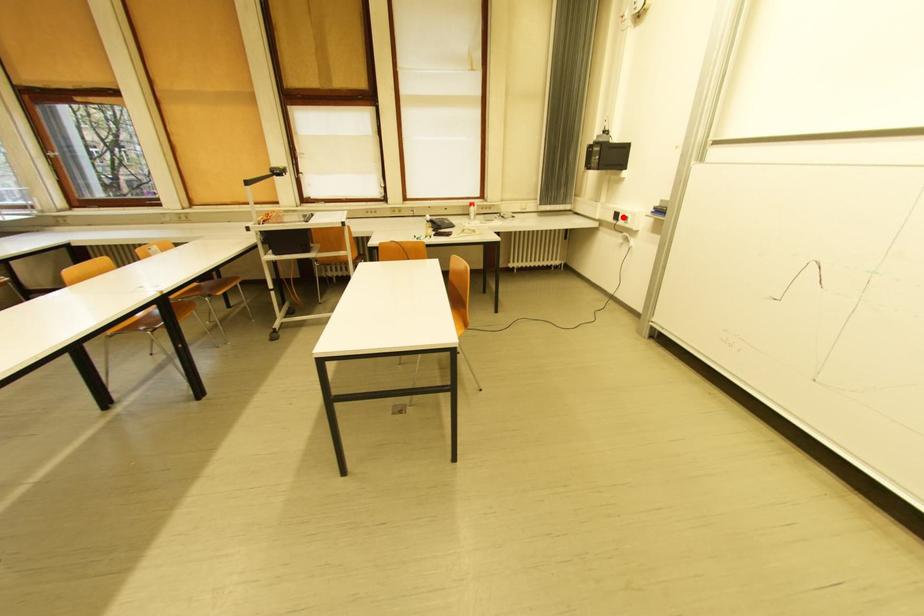
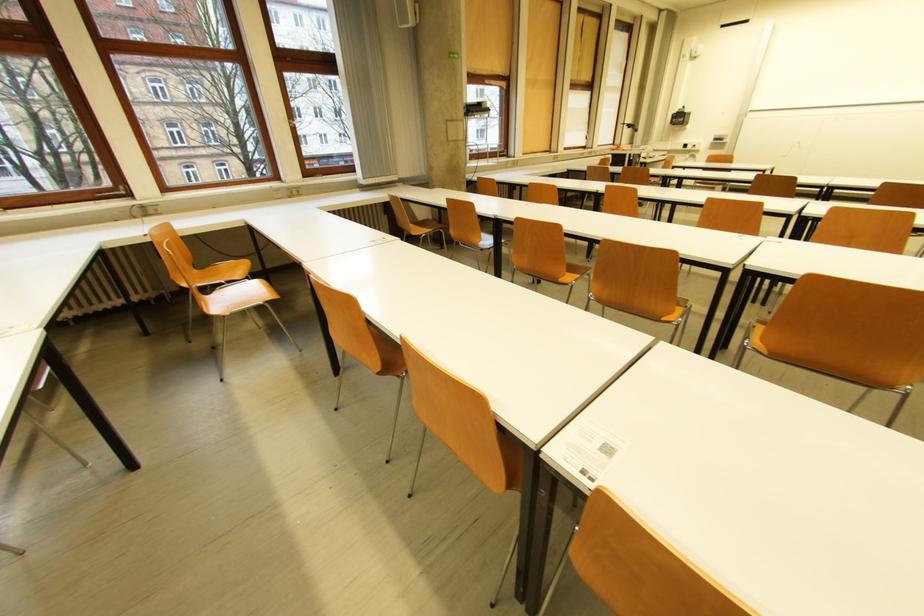
In the second image, find the point that corresponds to the highlighted location in the first image.

(691, 147)